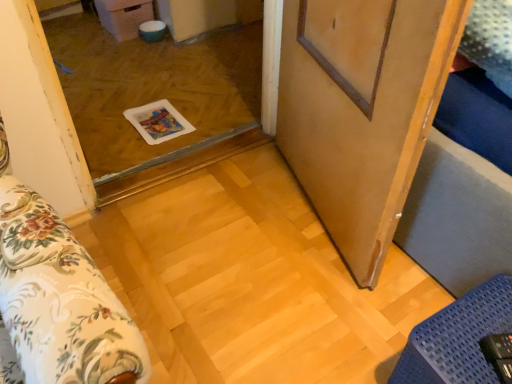
Question: In terms of width, does wooden barn door at center look wider or thinner when compared to blue textured mat at lower right?

Choices:
 (A) thin
 (B) wide

Answer: (A)

Question: Is wooden barn door at center inside the boundaries of blue textured mat at lower right, or outside?

Choices:
 (A) outside
 (B) inside

Answer: (A)

Question: Estimate the real-world distances between objects in this image. Which object is farther from the blue textured mat at lower right?

Choices:
 (A) wooden barn door at center
 (B) transparent plastic tray at center

Answer: (B)

Question: Estimate the real-world distances between objects in this image. Which object is farther from the wooden barn door at center?

Choices:
 (A) blue textured mat at lower right
 (B) transparent plastic tray at center

Answer: (B)